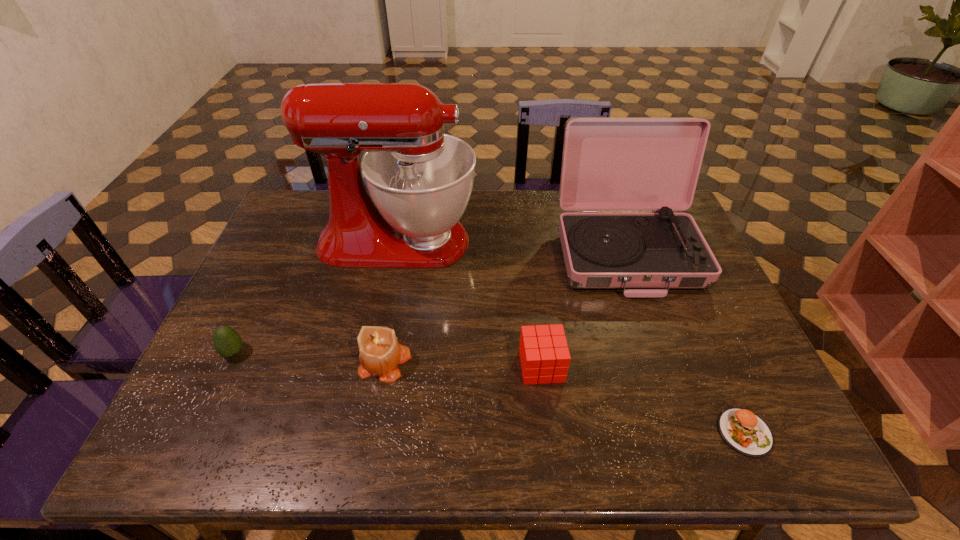
The image size is (960, 540). Identify the location of free space between the tallest object and the cube. (469, 304).

Locate an element on the screen. free spot between the shortest object and the record player is located at coordinates (685, 342).

This screenshot has height=540, width=960. I want to click on free space between the mixer and the candle, so click(x=392, y=302).

You are a GUI agent. You are given a task and a screenshot of the screen. Output one action in this format:
    pyautogui.click(x=<x>, y=<y>)
    Task: Click on the vacant space in between the shortest object and the mixer
    The image size is (960, 540).
    Given the screenshot: What is the action you would take?
    pyautogui.click(x=571, y=337)

The image size is (960, 540). Find the location of `vacant space in between the shortest object and the candle`. vacant space in between the shortest object and the candle is located at coordinates (564, 398).

Where is `vacant space that's between the patty and the fourth object from left to right`? The image size is (960, 540). vacant space that's between the patty and the fourth object from left to right is located at coordinates (643, 400).

This screenshot has width=960, height=540. In order to click on free area in between the cube and the mixer in this screenshot , I will do click(469, 304).

Find the location of a particular element. The height and width of the screenshot is (540, 960). vacant area between the tallest object and the record player is located at coordinates (512, 246).

Locate which object is the fifth closest to the nearest object. Please provide its 2D coordinates. Your answer should be formatted as a tuple, i.e. [(x, y)], where the tuple contains the x and y coordinates of a point satisfying the conditions above.

[(227, 342)]

Identify the location of the third closest object to the leftmost object. (544, 355).